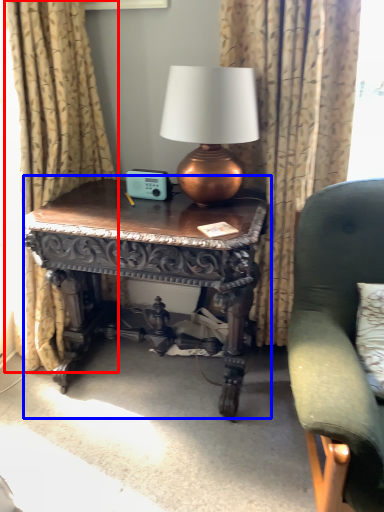
Question: Which object is closer to the camera taking this photo, curtain (highlighted by a red box) or table (highlighted by a blue box)?

Choices:
 (A) curtain
 (B) table

Answer: (A)